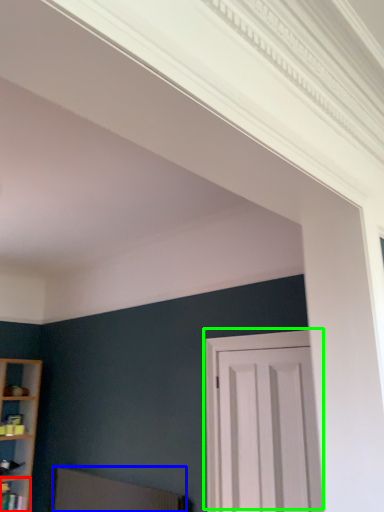
Question: Which object is the farthest from shelf (highlighted by a red box)? Choose among these: swivel chair (highlighted by a blue box) or door (highlighted by a green box).

Choices:
 (A) swivel chair
 (B) door

Answer: (B)